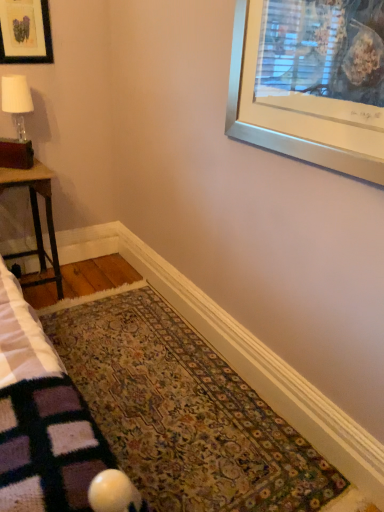
The width and height of the screenshot is (384, 512). In order to click on floral carpet at center in this screenshot , I will do `click(184, 412)`.

What is the approximate height of matte glass lamp at left?

17.24 inches.

This screenshot has height=512, width=384. Find the location of `wooden table at left`. wooden table at left is located at coordinates (36, 216).

Is matte glass lamp at left completely or partially inside wooden table at left?

No, matte glass lamp at left is not surrounded by wooden table at left.

You are a GUI agent. You are given a task and a screenshot of the screen. Output one action in this format:
    pyautogui.click(x=<x>, y=<y>)
    Task: Click on the lamp located behind the wooden table at left
    This screenshot has height=512, width=384.
    Given the screenshot: What is the action you would take?
    pyautogui.click(x=17, y=101)

From a real-world perspective, does wooden table at left sit lower than matte glass lamp at left?

Yes, from a real-world perspective, wooden table at left is beneath matte glass lamp at left.

Is wooden table at left aimed at matte glass lamp at left?

No, wooden table at left is not turned towards matte glass lamp at left.

Is floral carpet at center positioned with its back to matte black picture frame at upper left?

No, floral carpet at center is not facing the opposite direction of matte black picture frame at upper left.

Is floral carpet at center inside the boundaries of matte black picture frame at upper left, or outside?

floral carpet at center is not enclosed by matte black picture frame at upper left.

Can you confirm if floral carpet at center is wider than matte black picture frame at upper left?

Yes.

Image resolution: width=384 pixels, height=512 pixels. Find the location of `mat in front of the matte black picture frame at upper left`. mat in front of the matte black picture frame at upper left is located at coordinates (184, 412).

Is matte black picture frame at upper left at the left side of floral carpet at center?

Correct, you'll find matte black picture frame at upper left to the left of floral carpet at center.

Measure the distance between matte black picture frame at upper left and floral carpet at center.

matte black picture frame at upper left and floral carpet at center are 5.31 feet apart from each other.

This screenshot has width=384, height=512. I want to click on picture frame that appears above the floral carpet at center (from a real-world perspective), so click(x=25, y=32).

Who is taller, matte black picture frame at upper left or floral carpet at center?

matte black picture frame at upper left is taller.

From the image's perspective, which is above, matte black picture frame at upper left or matte glass lamp at left?

matte black picture frame at upper left, from the image's perspective.

Which is further, [18,27] or [15,77]?

The point [15,77] is farther from the camera.

From a real-world perspective, between matte black picture frame at upper left and matte glass lamp at left, who is vertically lower?

matte glass lamp at left is physically lower.

Considering the sizes of matte black picture frame at upper left and matte glass lamp at left in the image, is matte black picture frame at upper left taller or shorter than matte glass lamp at left?

Clearly, matte black picture frame at upper left is shorter compared to matte glass lamp at left.

This screenshot has width=384, height=512. Identify the location of table on the left of floral carpet at center. (36, 216).

Considering the sizes of objects floral carpet at center and wooden table at left in the image provided, who is smaller, floral carpet at center or wooden table at left?

wooden table at left.

Do you think floral carpet at center is within wooden table at left, or outside of it?

floral carpet at center is located beyond the bounds of wooden table at left.

Is floral carpet at center thinner than wooden table at left?

No.

Is matte glass lamp at left wider than matte black picture frame at upper left?

Yes.

How different are the orientations of matte glass lamp at left and matte black picture frame at upper left in degrees?

matte glass lamp at left and matte black picture frame at upper left are facing 2.64 degrees away from each other.

Is matte glass lamp at left inside or outside of matte black picture frame at upper left?

matte glass lamp at left is not inside matte black picture frame at upper left, it's outside.

Which is in front, matte glass lamp at left or matte black picture frame at upper left?

matte black picture frame at upper left is more forward.

Does floral carpet at center come behind matte glass lamp at left?

No, it is in front of matte glass lamp at left.

How different are the orientations of floral carpet at center and matte glass lamp at left in degrees?

2.4 degrees separate the facing orientations of floral carpet at center and matte glass lamp at left.

From a real-world perspective, between floral carpet at center and matte glass lamp at left, who is vertically lower?

From a 3D spatial view, floral carpet at center is below.

Can you see floral carpet at center touching matte glass lamp at left?

No, floral carpet at center is not touching matte glass lamp at left.

Identify the location of table that is in front of the matte glass lamp at left. The height and width of the screenshot is (512, 384). (36, 216).

The height and width of the screenshot is (512, 384). Identify the location of picture frame located above the floral carpet at center (from a real-world perspective). (25, 32).

From the image, which object appears to be nearer to floral carpet at center, wooden table at left or matte black picture frame at upper left?

wooden table at left is positioned closer to the anchor floral carpet at center.

Looking at the image, which one is located further to wooden table at left, floral carpet at center or matte glass lamp at left?

floral carpet at center is further to wooden table at left.

From the image, which object appears to be nearer to matte glass lamp at left, floral carpet at center or wooden table at left?

wooden table at left.

Based on their spatial positions, is matte black picture frame at upper left or floral carpet at center closer to matte glass lamp at left?

The object closer to matte glass lamp at left is matte black picture frame at upper left.

Estimate the real-world distances between objects in this image. Which object is further from matte black picture frame at upper left, matte glass lamp at left or wooden table at left?

wooden table at left.

Estimate the real-world distances between objects in this image. Which object is closer to matte black picture frame at upper left, floral carpet at center or matte glass lamp at left?

matte glass lamp at left is positioned closer to the anchor matte black picture frame at upper left.

Based on their spatial positions, is floral carpet at center or matte black picture frame at upper left closer to matte glass lamp at left?

The object closer to matte glass lamp at left is matte black picture frame at upper left.

Looking at the image, which one is located closer to matte glass lamp at left, wooden table at left or floral carpet at center?

wooden table at left.

Identify the location of lamp between matte black picture frame at upper left and wooden table at left from top to bottom. This screenshot has width=384, height=512. (17, 101).

Where is `lamp between matte black picture frame at upper left and floral carpet at center vertically`? Image resolution: width=384 pixels, height=512 pixels. lamp between matte black picture frame at upper left and floral carpet at center vertically is located at coordinates (17, 101).

Image resolution: width=384 pixels, height=512 pixels. In order to click on table between matte glass lamp at left and floral carpet at center from top to bottom in this screenshot , I will do `click(36, 216)`.

The height and width of the screenshot is (512, 384). What are the coordinates of `table between matte black picture frame at upper left and floral carpet at center from top to bottom` in the screenshot? It's located at (36, 216).